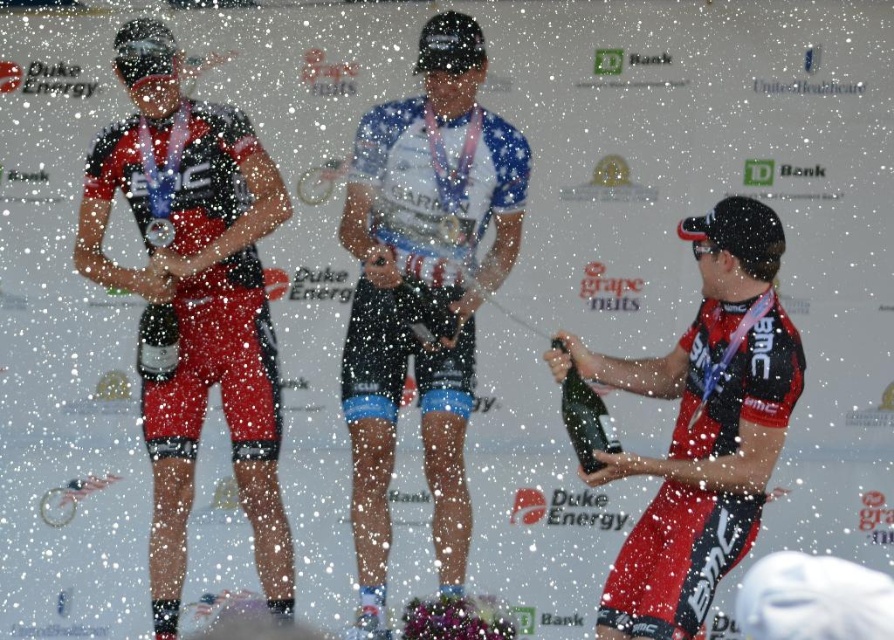
Looking at this image, you are a photographer positioned at the center of the stage. You want to take a photo of the matte black jersey at right. Where should you point your camera to capture it?

The matte black jersey at right is located at the 2D coordinates point 0.667 on the x axis and 0.785 on the y axis, so you should point your camera towards those coordinates to capture it.

You are a photographer positioned at the front of the podium. You need to capture a closeup shot of the metallic silver medal at center without the matte black jersey at right blocking the view. Is this possible given their positions?

The matte black jersey at right might be wider than metallic silver medal at center, so there is a possibility that the jersey could block the medal in your shot. Adjust your angle to ensure the medal is fully visible.

You are a photographer at the event. You want to take a photo focusing on the metallic silver medal at center without the shiny silver bottle at right appearing too prominent. Based on their positions, can you angle your camera so the medal is in focus and the bottle is slightly out of frame?

The shiny silver bottle at right is closer to the viewer than the metallic silver medal at center. By angling the camera slightly away from the bottle and focusing on the medal, which is further back, you can position the medal in the foreground while the bottle might be moved out of the frame or reduced in prominence due to its closer proximity to the camera.